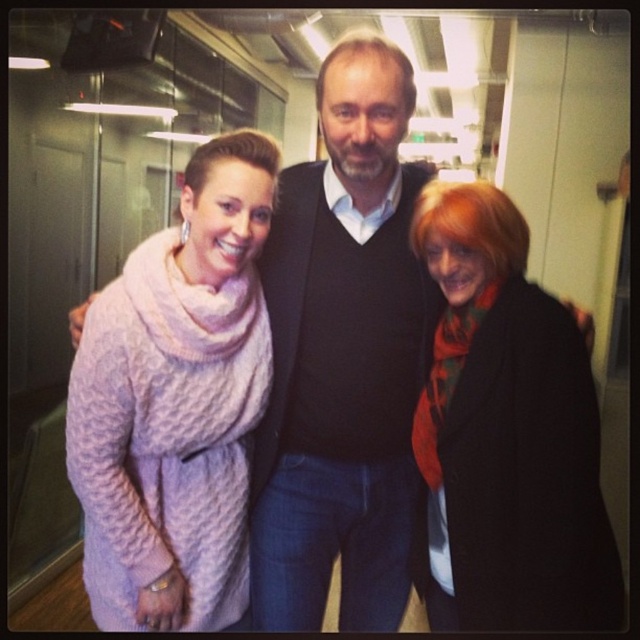
Question: Which of the following is the farthest from the observer?

Choices:
 (A) cable-knit sweater at center
 (B) orange scarf at right
 (C) dark gray sweater at center

Answer: (C)

Question: Which object appears closest to the camera in this image?

Choices:
 (A) orange scarf at right
 (B) cable-knit sweater at center
 (C) dark gray sweater at center

Answer: (A)

Question: Estimate the real-world distances between objects in this image. Which object is closer to the dark gray sweater at center?

Choices:
 (A) cable-knit sweater at center
 (B) orange scarf at right

Answer: (A)

Question: Can you confirm if dark gray sweater at center is positioned above cable-knit sweater at center?

Choices:
 (A) yes
 (B) no

Answer: (A)

Question: Does dark gray sweater at center appear on the left side of orange scarf at right?

Choices:
 (A) no
 (B) yes

Answer: (B)

Question: Can you confirm if dark gray sweater at center is positioned to the right of orange scarf at right?

Choices:
 (A) yes
 (B) no

Answer: (B)